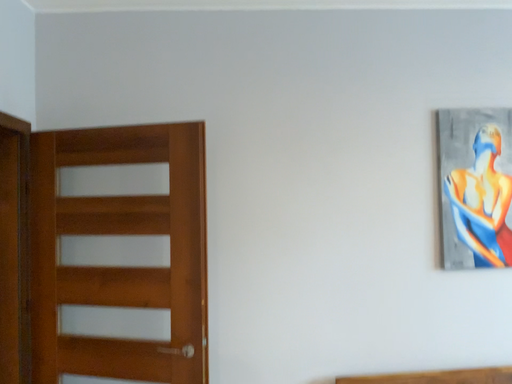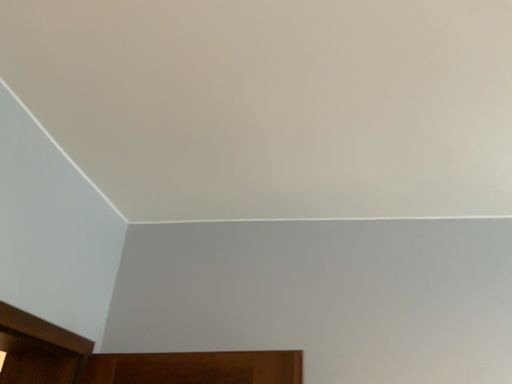
Question: How did the camera likely rotate when shooting the video?

Choices:
 (A) rotated right
 (B) rotated left

Answer: (B)